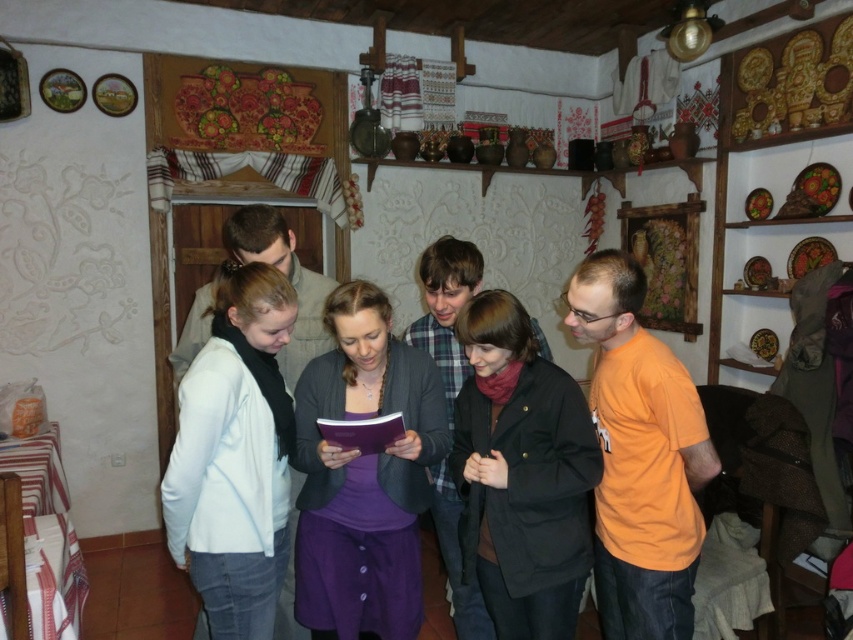
Question: Does orange cotton t-shirt at right have a lesser width compared to purple matte sweater at center?

Choices:
 (A) yes
 (B) no

Answer: (A)

Question: Estimate the real-world distances between objects in this image. Which object is farther from the orange cotton t-shirt at right?

Choices:
 (A) purple matte dress at center
 (B) orange cotton shirt at center
 (C) purple matte sweater at center
 (D) light blue fabric jacket at left

Answer: (D)

Question: Does orange cotton shirt at center appear on the left side of purple matte sweater at center?

Choices:
 (A) no
 (B) yes

Answer: (A)

Question: Based on their relative distances, which object is nearer to the orange cotton t-shirt at right?

Choices:
 (A) orange cotton shirt at center
 (B) light blue fabric jacket at left
 (C) purple matte dress at center

Answer: (A)

Question: Among these points, which one is farthest from the camera?

Choices:
 (A) (646, 333)
 (B) (469, 298)
 (C) (230, 480)
 (D) (357, 365)

Answer: (B)

Question: Can you confirm if purple matte dress at center is positioned to the left of orange cotton t-shirt at right?

Choices:
 (A) no
 (B) yes

Answer: (B)